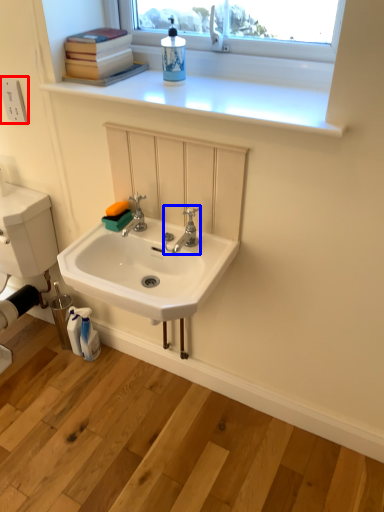
Question: Which object is closer to the camera taking this photo, electric outlet (highlighted by a red box) or tap (highlighted by a blue box)?

Choices:
 (A) electric outlet
 (B) tap

Answer: (B)